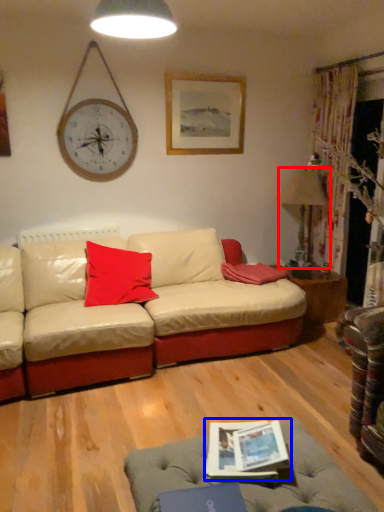
Question: Which object is further to the camera taking this photo, lamp (highlighted by a red box) or magazine (highlighted by a blue box)?

Choices:
 (A) lamp
 (B) magazine

Answer: (A)